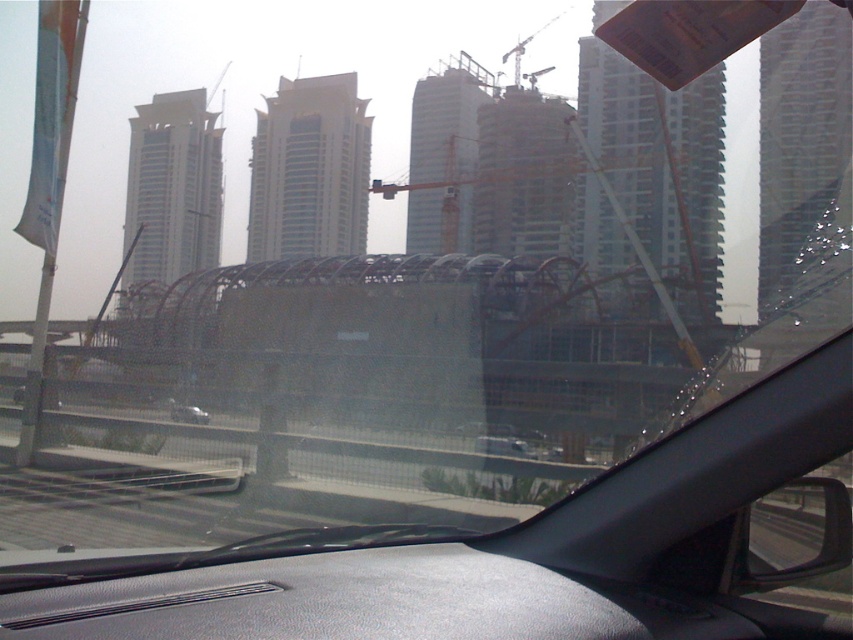
Who is more forward, (515, 448) or (181, 410)?

Point (515, 448)

Is white matte car at center closer to the viewer compared to silver metallic car at center?

Yes.

Find the location of a particular element. The height and width of the screenshot is (640, 853). white matte car at center is located at coordinates (502, 445).

Is gray textured dashboard at center to the left of silver metallic car at center from the viewer's perspective?

In fact, gray textured dashboard at center is to the right of silver metallic car at center.

Can you confirm if gray textured dashboard at center is shorter than silver metallic car at center?

Yes, gray textured dashboard at center is shorter than silver metallic car at center.

What do you see at coordinates (363, 602) in the screenshot?
I see `gray textured dashboard at center` at bounding box center [363, 602].

Locate an element on the screen. The height and width of the screenshot is (640, 853). gray textured dashboard at center is located at coordinates (363, 602).

Which of these two, gray textured dashboard at center or white matte car at center, stands taller?

white matte car at center

Between point (425, 612) and point (502, 452), which one is positioned in front?

Point (425, 612)

Describe the element at coordinates (363, 602) in the screenshot. This screenshot has width=853, height=640. I see `gray textured dashboard at center` at that location.

Identify the location of gray textured dashboard at center. (363, 602).